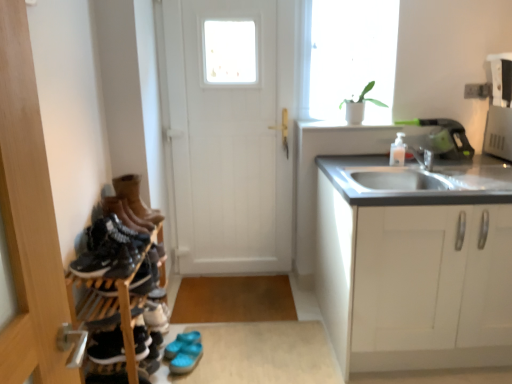
Find the location of a particular element. The height and width of the screenshot is (384, 512). free space to the back side of blue rubber sandals at lower center, the 1th footwear in the back-to-front sequence is located at coordinates (205, 329).